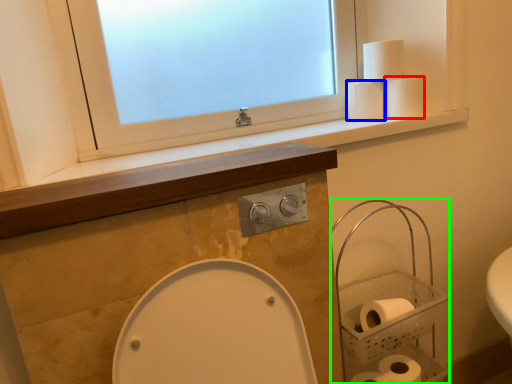
Question: Which is farther away from toilet paper (highlighted by a red box)? toilet paper (highlighted by a blue box) or basket (highlighted by a green box)?

Choices:
 (A) toilet paper
 (B) basket

Answer: (B)